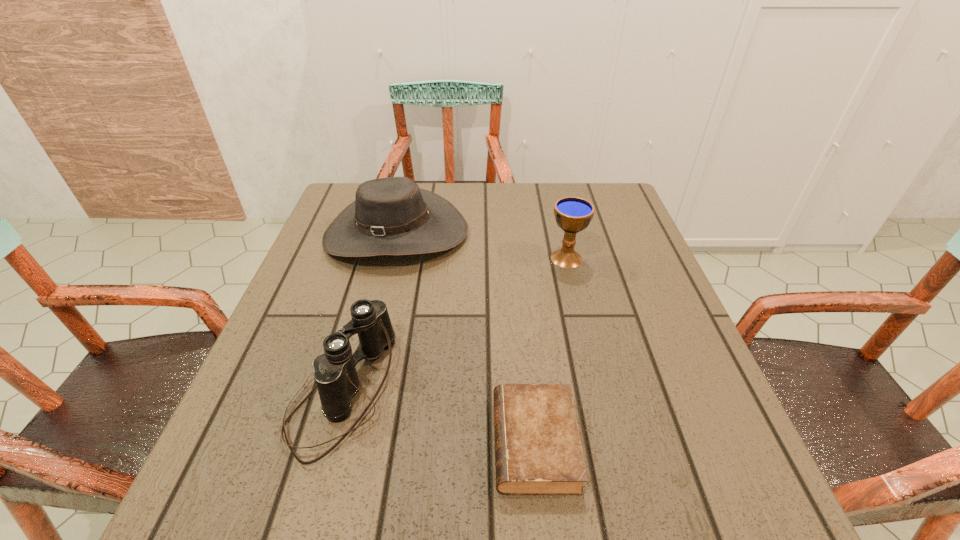
Image resolution: width=960 pixels, height=540 pixels. I want to click on free point between the chalice and the third object from left to right, so click(550, 350).

You are a GUI agent. You are given a task and a screenshot of the screen. Output one action in this format:
    pyautogui.click(x=<x>, y=<y>)
    Task: Click on the object that is the third closest to the cowboy hat
    This screenshot has height=540, width=960.
    Given the screenshot: What is the action you would take?
    pyautogui.click(x=538, y=451)

The image size is (960, 540). In order to click on object identified as the third closest to the cowboy hat in this screenshot , I will do `click(538, 451)`.

The height and width of the screenshot is (540, 960). I want to click on vacant space that satisfies the following two spatial constraints: 1. on the front side of the chalice; 2. on the spine side of the shortest object, so click(611, 443).

Where is `vacant region that satisfies the following two spatial constraints: 1. on the front-facing side of the cowboy hat; 2. on the right side of the chalice`? vacant region that satisfies the following two spatial constraints: 1. on the front-facing side of the cowboy hat; 2. on the right side of the chalice is located at coordinates pyautogui.click(x=390, y=258).